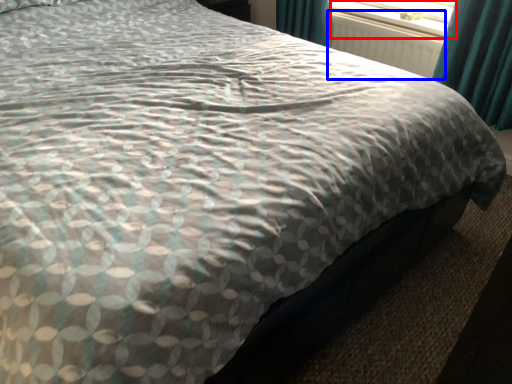
Question: Among these objects, which one is farthest to the camera, window screen (highlighted by a red box) or radiator (highlighted by a blue box)?

Choices:
 (A) window screen
 (B) radiator

Answer: (A)